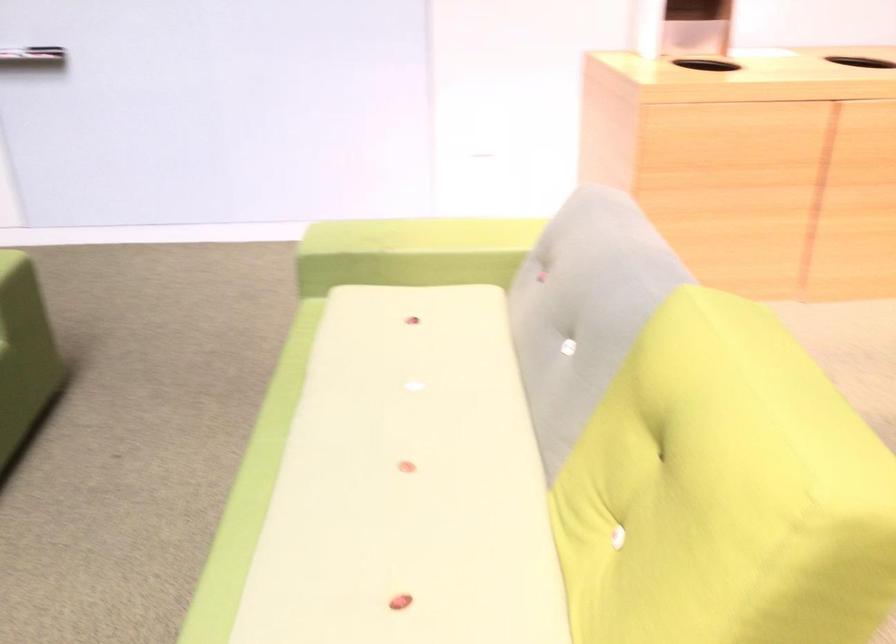
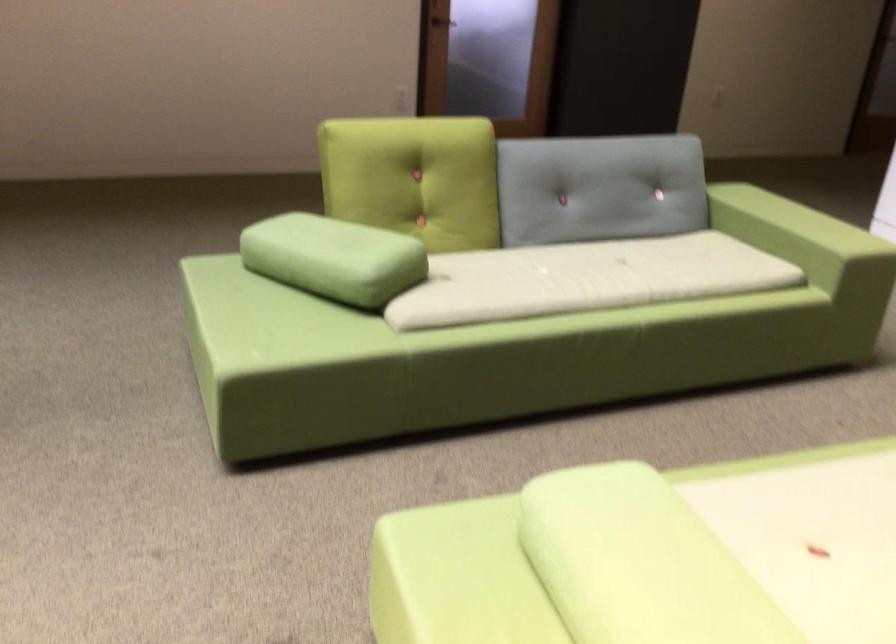
Question: Based on the continuous images, in which direction is the camera rotating? Reply with the corresponding letter.

Choices:
 (A) Left
 (B) Right
 (C) Up
 (D) Down

Answer: (A)